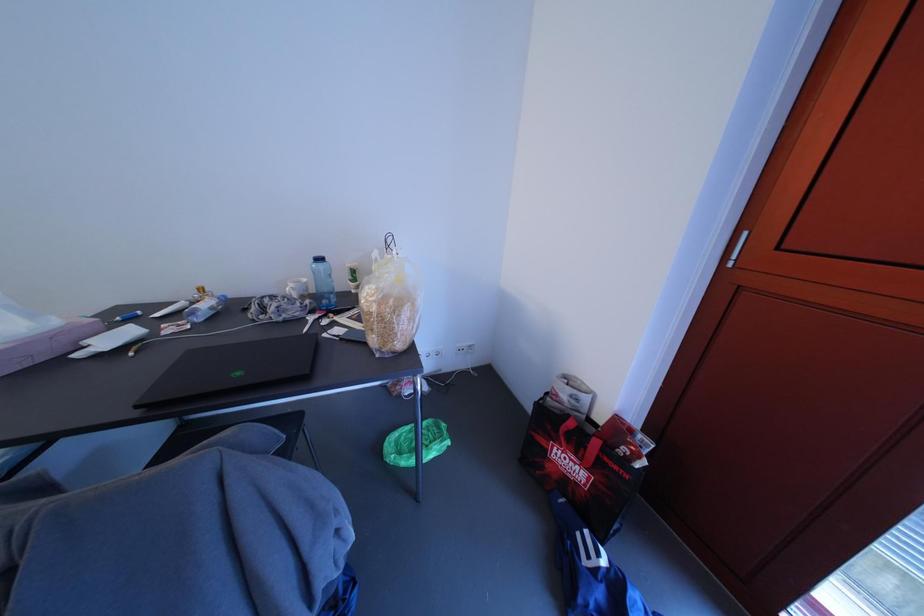
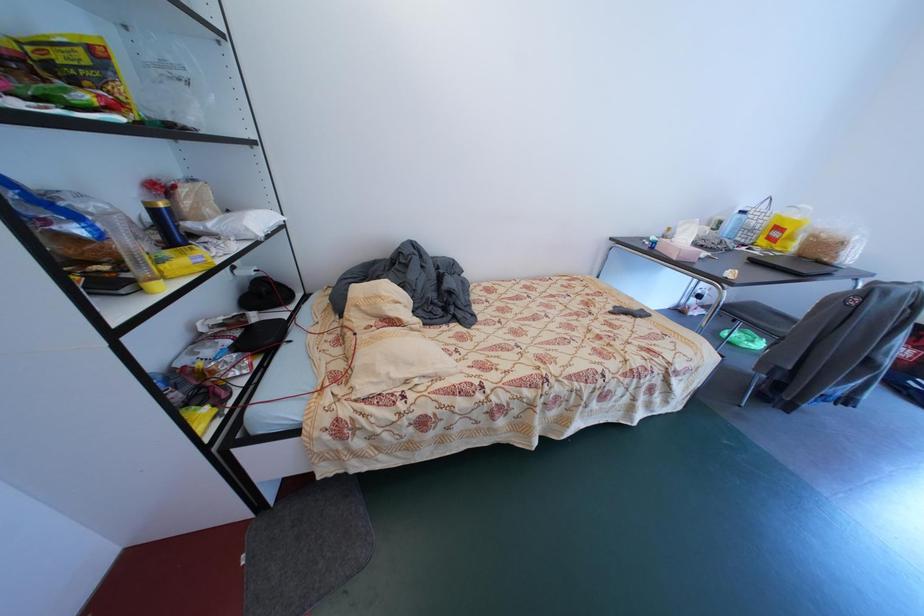
Based on the photo, the images are taken continuously from a first-person perspective. In which direction are you moving?

The movement direction of the cameraman is left, backward.